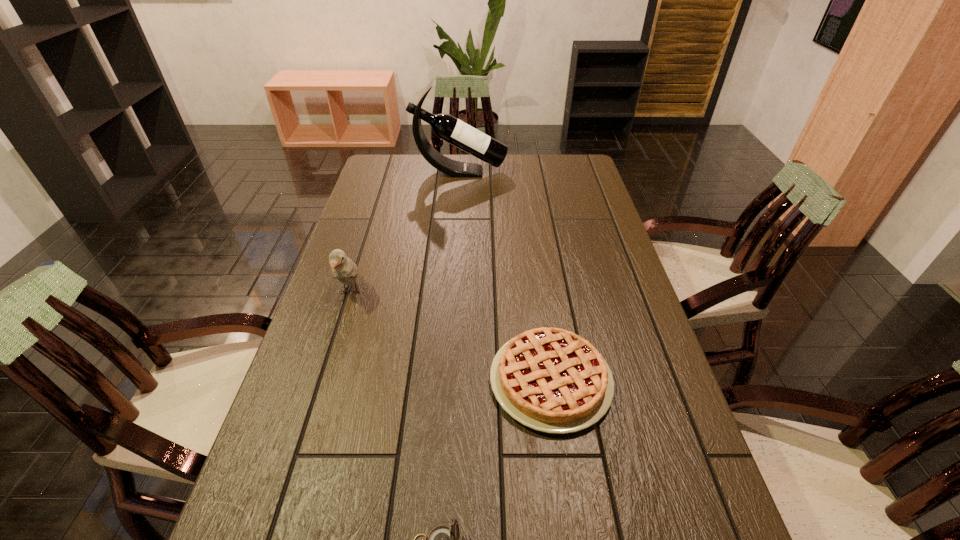
This screenshot has height=540, width=960. What are the coordinates of `object that is at the left edge` in the screenshot? It's located at 343,269.

The image size is (960, 540). Find the location of `object at the right edge`. object at the right edge is located at coordinates (552, 380).

In the image, there is a desktop. Find the location of `vacant space at the far edge`. vacant space at the far edge is located at coordinates (517, 161).

Find the location of `vacant space at the left edge of the desktop`. vacant space at the left edge of the desktop is located at coordinates (369, 198).

Locate an element on the screen. The height and width of the screenshot is (540, 960). free spot at the right edge of the desktop is located at coordinates (618, 319).

You are a GUI agent. You are given a task and a screenshot of the screen. Output one action in this format:
    pyautogui.click(x=<x>, y=<y>)
    Task: Click on the vacant space at the far left corner of the desktop
    The image size is (960, 540).
    Given the screenshot: What is the action you would take?
    pyautogui.click(x=372, y=174)

The image size is (960, 540). What are the coordinates of `vacant area at the far right corner` in the screenshot? It's located at point(551,166).

Locate an element on the screen. The width and height of the screenshot is (960, 540). unoccupied area between the bird and the second nearest object is located at coordinates (450, 336).

Locate an element on the screen. vacant point located between the bird and the shortest object is located at coordinates (450, 336).

Identify the location of object that is the third closest to the second shortest object. (447, 127).